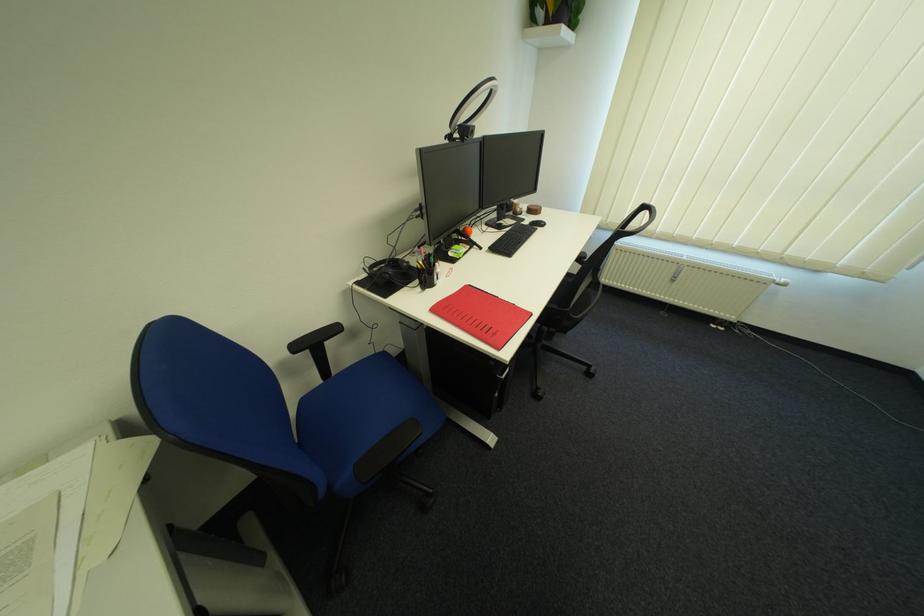
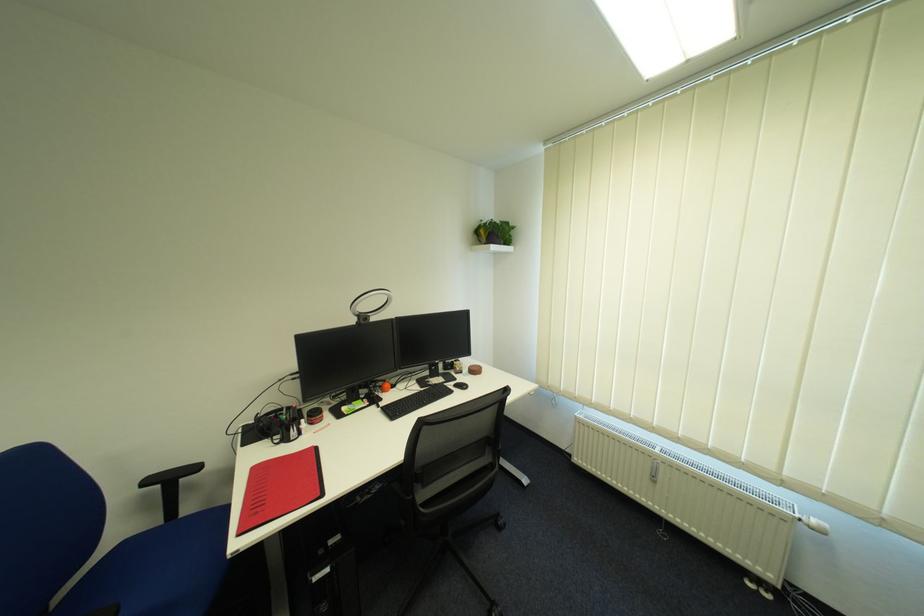
Where in the second image is the point corresponding to [373,270] from the first image?

(268, 415)